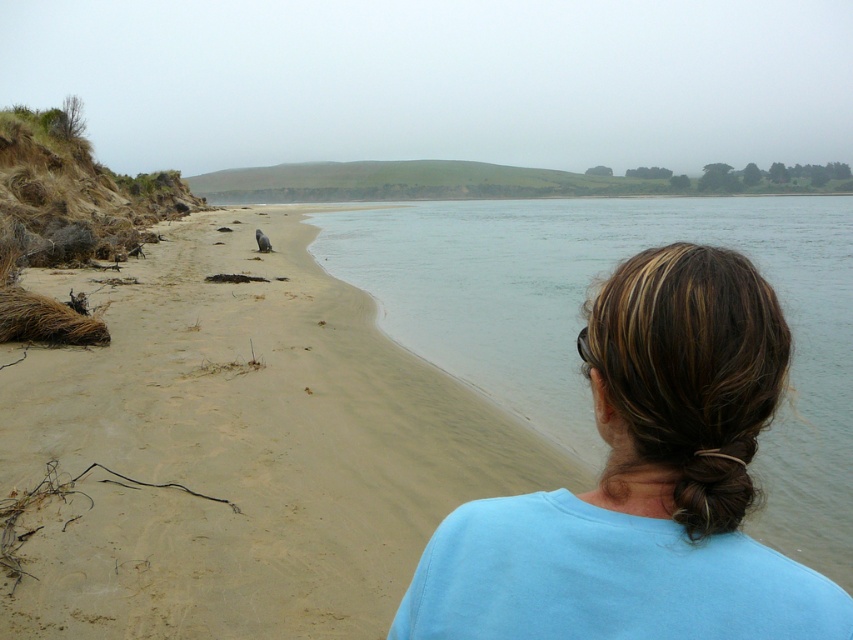
Question: Is sandy beach at lower left positioned behind blue fabric hair at center?

Choices:
 (A) yes
 (B) no

Answer: (A)

Question: Which of the following is the closest to the observer?

Choices:
 (A) sandy beach at lower left
 (B) blue fabric hair at center

Answer: (B)

Question: Which of the following is the farthest from the observer?

Choices:
 (A) (618, 538)
 (B) (248, 538)

Answer: (B)

Question: Can you confirm if sandy beach at lower left is smaller than blue fabric hair at center?

Choices:
 (A) no
 (B) yes

Answer: (A)

Question: Does sandy beach at lower left have a greater width compared to blue fabric hair at center?

Choices:
 (A) yes
 (B) no

Answer: (A)